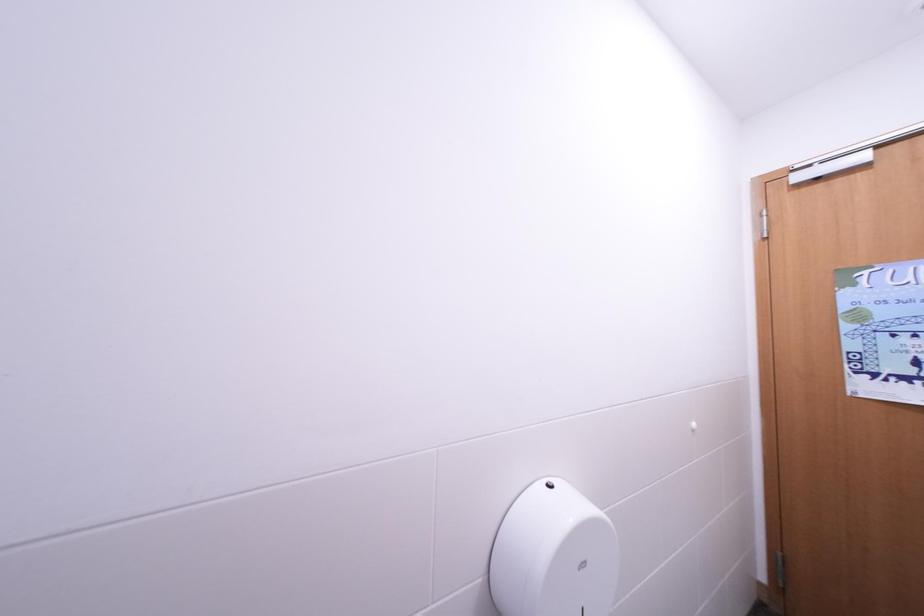
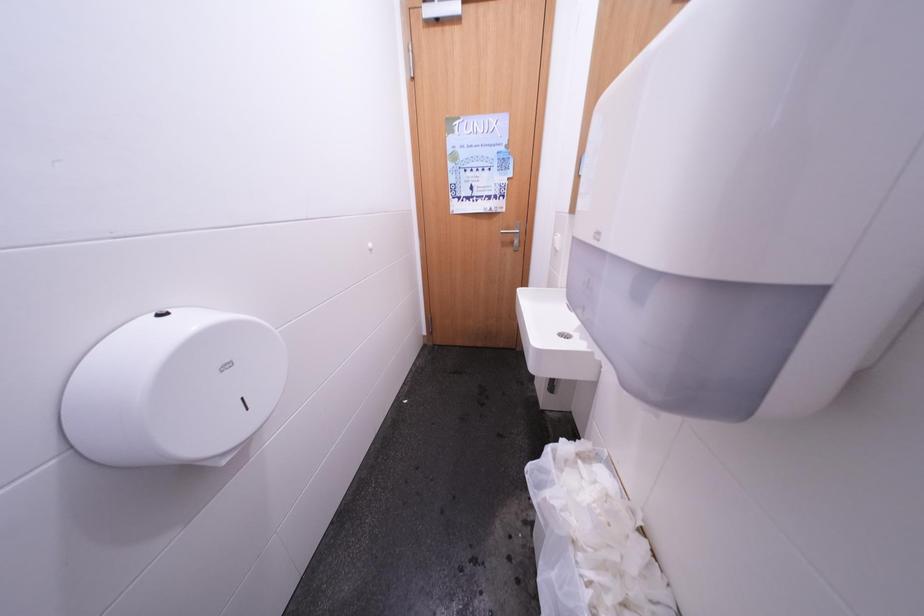
First-person continuous shooting, in which direction is the camera rotating?

The camera rotated toward right-down.